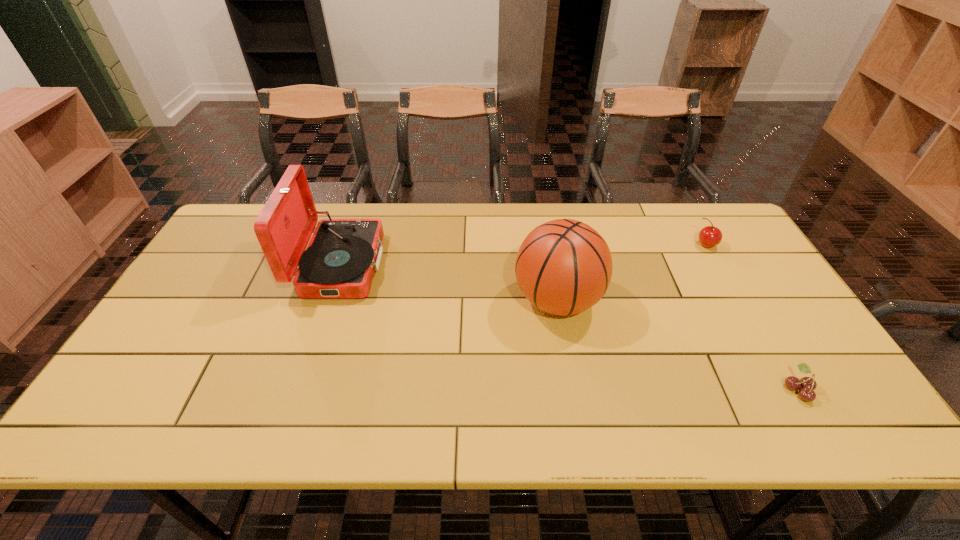
Where is `free space at the right edge of the desktop`? The height and width of the screenshot is (540, 960). free space at the right edge of the desktop is located at coordinates (734, 258).

Find the location of a particular element. The width and height of the screenshot is (960, 540). vacant space at the near right corner of the desktop is located at coordinates (799, 408).

Identify the location of unoccupied position between the leftmost object and the third object from right to left. The width and height of the screenshot is (960, 540). (449, 283).

Where is `free space between the farther cherry and the third object from right to left`? free space between the farther cherry and the third object from right to left is located at coordinates (632, 273).

Where is `blank region between the basketball and the second shortest object`? The height and width of the screenshot is (540, 960). blank region between the basketball and the second shortest object is located at coordinates (632, 273).

Where is `vacant area that lies between the third object from right to left and the farther cherry`? This screenshot has width=960, height=540. vacant area that lies between the third object from right to left and the farther cherry is located at coordinates (632, 273).

Find the location of a particular element. This screenshot has height=540, width=960. vacant area that lies between the third object from right to left and the shorter cherry is located at coordinates (678, 345).

Find the location of `free space between the third object from right to left and the shorter cherry`. free space between the third object from right to left and the shorter cherry is located at coordinates (678, 345).

This screenshot has width=960, height=540. Find the location of `free point between the shortest object and the leftmost object`. free point between the shortest object and the leftmost object is located at coordinates (569, 327).

Image resolution: width=960 pixels, height=540 pixels. I want to click on vacant area between the taller cherry and the nearer cherry, so click(x=752, y=317).